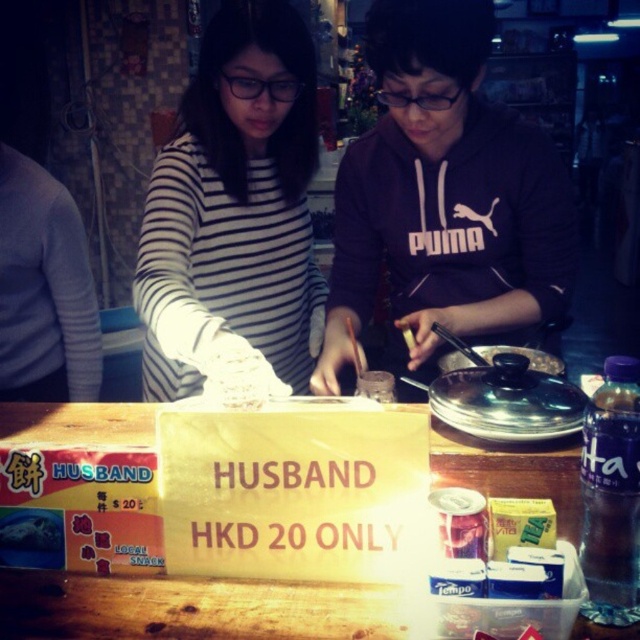
Consider the image. Is striped fabric shirt at left in front of white matte gloves at center?

That is True.

Is point (348, 262) farther from viewer compared to point (189, 246)?

Yes.

Describe the element at coordinates (353, 209) in the screenshot. This screenshot has width=640, height=640. I see `striped fabric shirt at left` at that location.

This screenshot has height=640, width=640. I want to click on striped fabric shirt at left, so click(353, 209).

Between white matte gloves at center and wooden table at center, which one appears on the left side from the viewer's perspective?

From the viewer's perspective, white matte gloves at center appears more on the left side.

Which of these two, white matte gloves at center or wooden table at center, stands taller?

white matte gloves at center

I want to click on white matte gloves at center, so click(x=234, y=211).

Does striped fabric shirt at left have a lesser width compared to wooden table at center?

No.

Does striped fabric shirt at left have a larger size compared to wooden table at center?

Yes, striped fabric shirt at left is bigger than wooden table at center.

Where is `striped fabric shirt at left`? The width and height of the screenshot is (640, 640). striped fabric shirt at left is located at coordinates (353, 209).